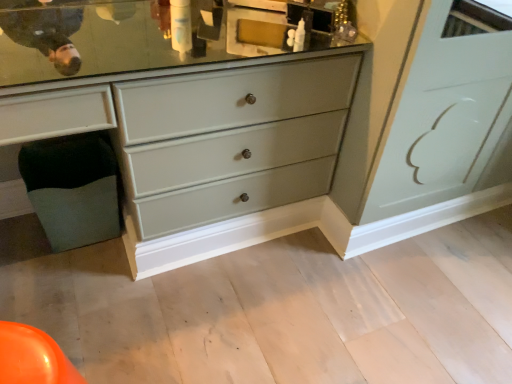
The height and width of the screenshot is (384, 512). Identify the location of free space in front of satin gray dresser at center. (168, 323).